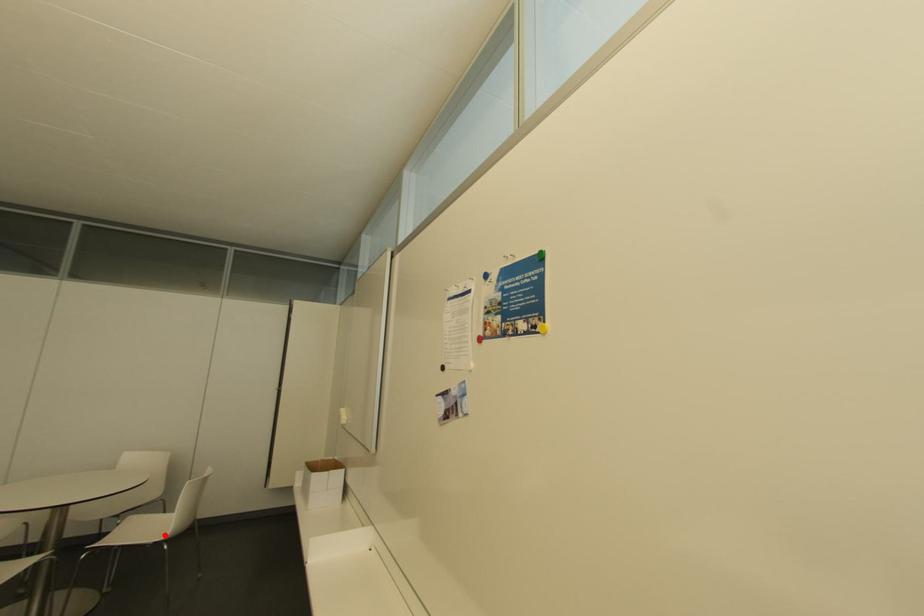
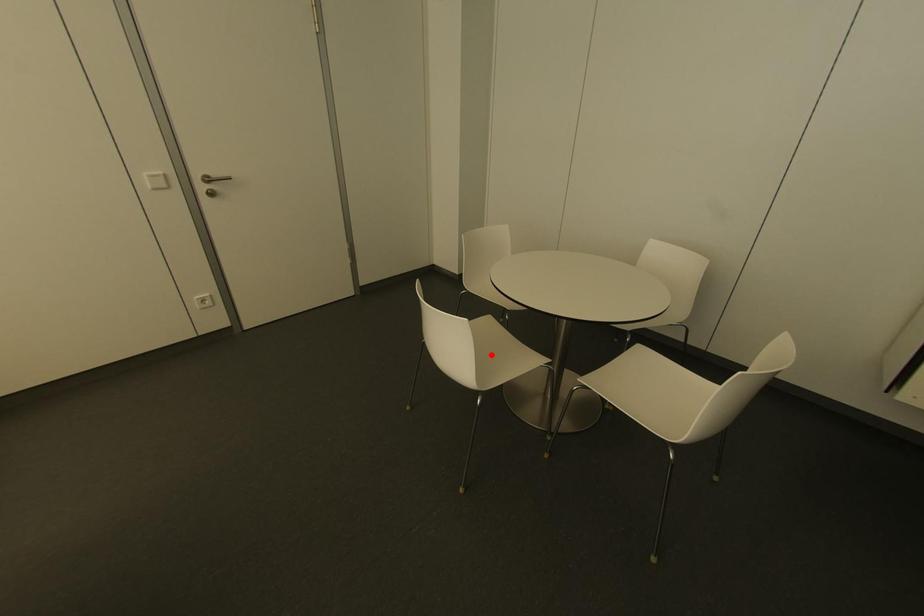
I am providing you with two images of the same scene from different viewpoints. A red point is marked on the first image and another point is marked on the second image. Does the point marked in image1 correspond to the same location as the one in image2?

No